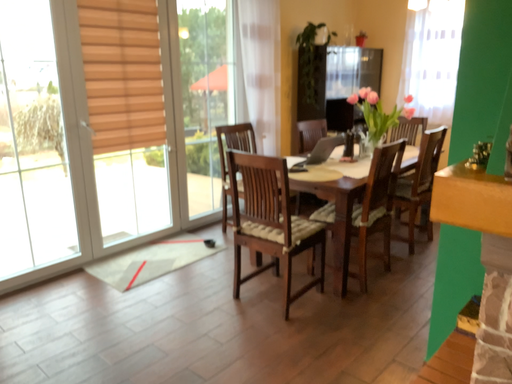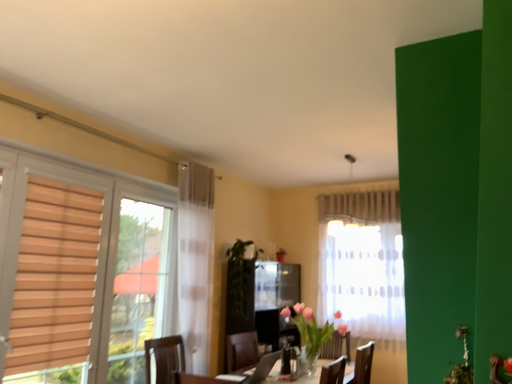
Question: Which way did the camera rotate in the video?

Choices:
 (A) rotated right
 (B) rotated left

Answer: (A)